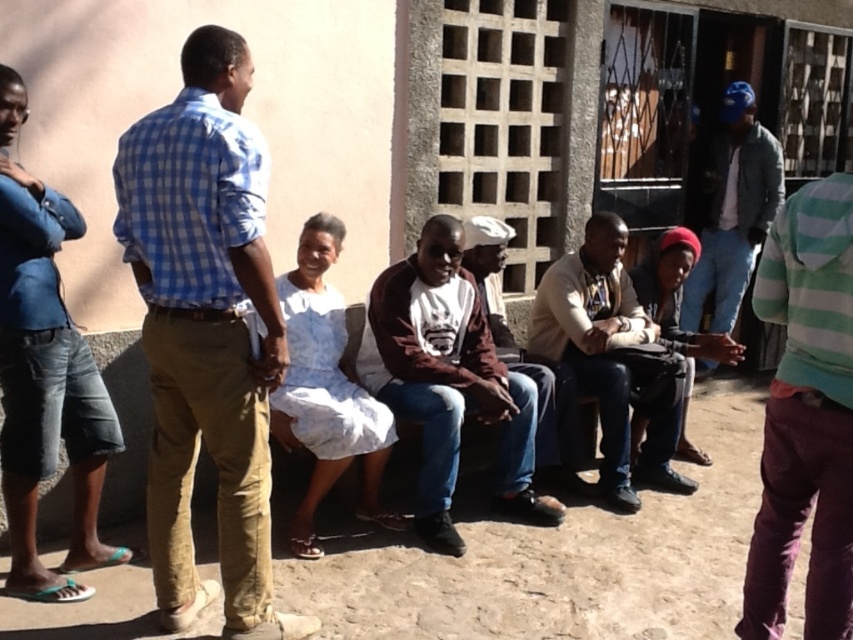
You are standing in the scene and want to hand a document to both the light brown leather jacket at center and the maroon fabric shirt at center. Which one should you approach first to ensure you can reach them without moving around others?

You should approach the light brown leather jacket at center first because it is closer to you than the maroon fabric shirt at center, so you can reach them without needing to move around others.

You are organizing a charity event and need to decide which clothing item to display first. Given the light brown leather jacket at center and the maroon fabric shirt at center, which one takes up more space and should be prioritized for visibility?

The light brown leather jacket at center is larger in size than the maroon fabric shirt at center, so it takes up more space and should be prioritized for visibility.

You are a photographer trying to capture a group photo of the scene. You need to ensure that both the leather drum at lower right and the maroon fabric shirt at center are visible in the frame. Based on their positions, which object should be placed closer to the right edge of the photo to achieve this?

The leather drum at lower right should be placed closer to the right edge of the photo since it is already positioned to the right of the maroon fabric shirt at center.